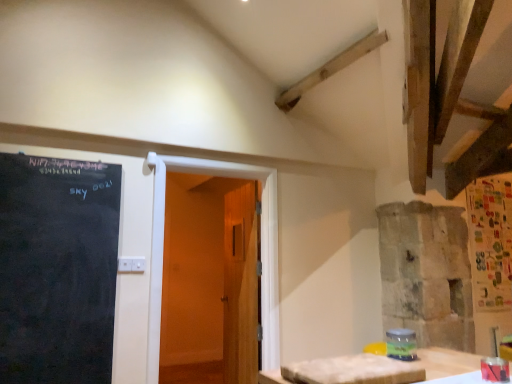
Image resolution: width=512 pixels, height=384 pixels. Identify the location of free spot above blackboard at left (from a real-world perspective). (64, 157).